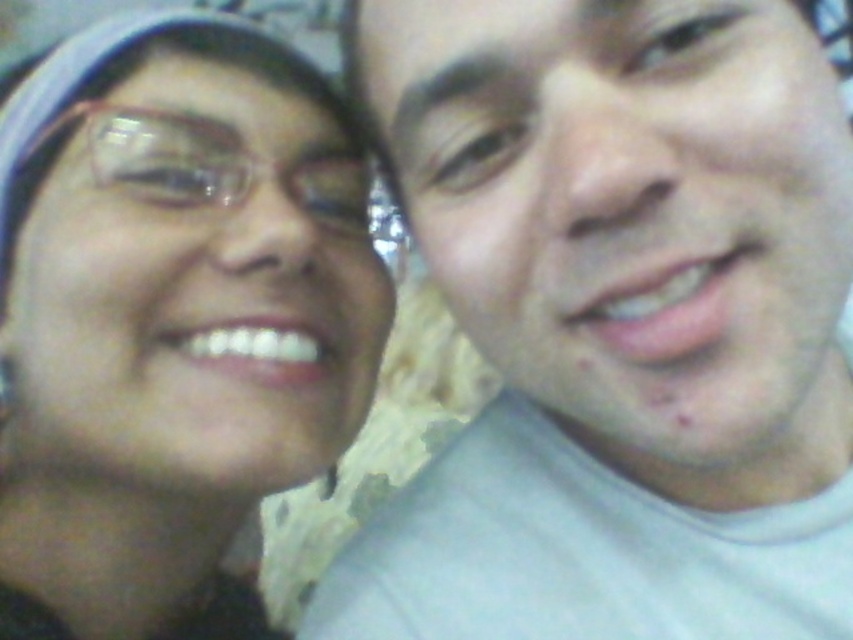
Question: Is matte gray shirt at right below matte black glasses at upper left?

Choices:
 (A) no
 (B) yes

Answer: (A)

Question: Is matte gray shirt at right to the right of matte black glasses at upper left from the viewer's perspective?

Choices:
 (A) no
 (B) yes

Answer: (B)

Question: Among these objects, which one is nearest to the camera?

Choices:
 (A) matte gray shirt at right
 (B) matte black glasses at upper left

Answer: (A)

Question: Can you confirm if matte gray shirt at right is bigger than matte black glasses at upper left?

Choices:
 (A) no
 (B) yes

Answer: (A)